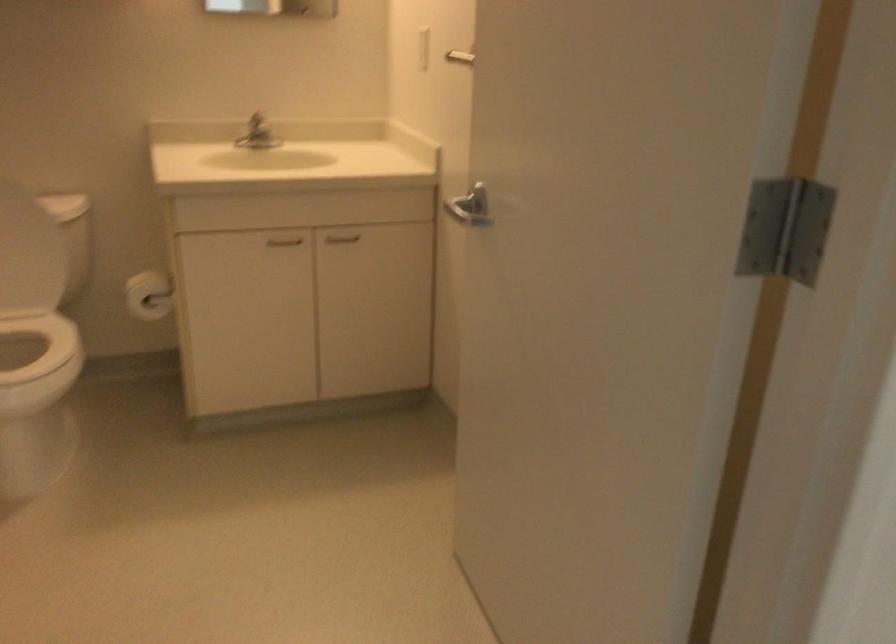
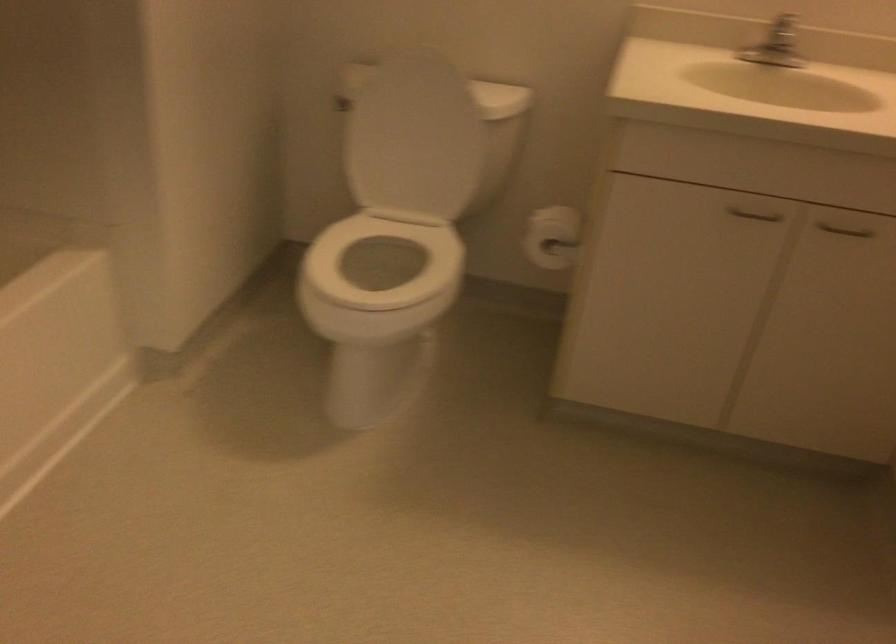
Find the pixel in the second image that matches the point at 144,290 in the first image.

(552, 237)